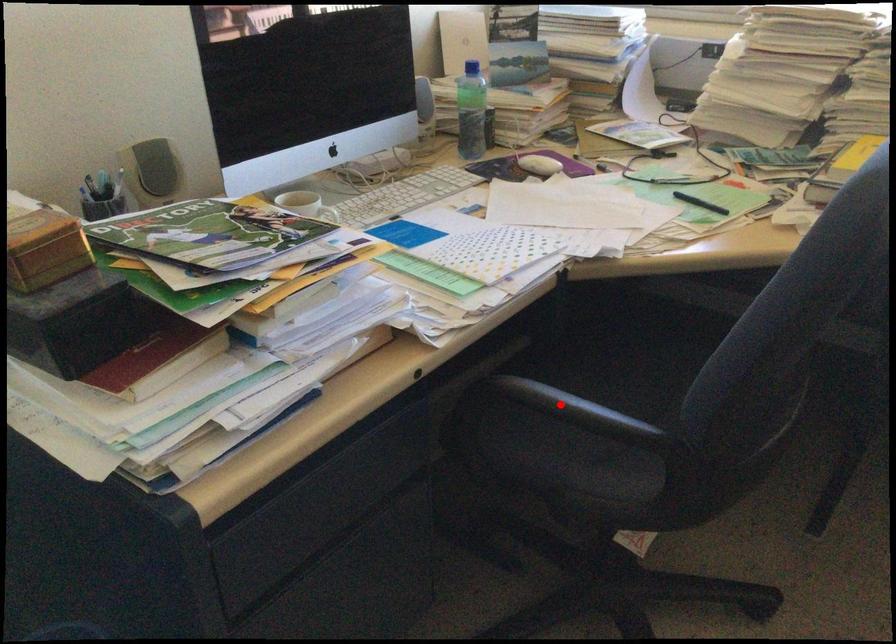
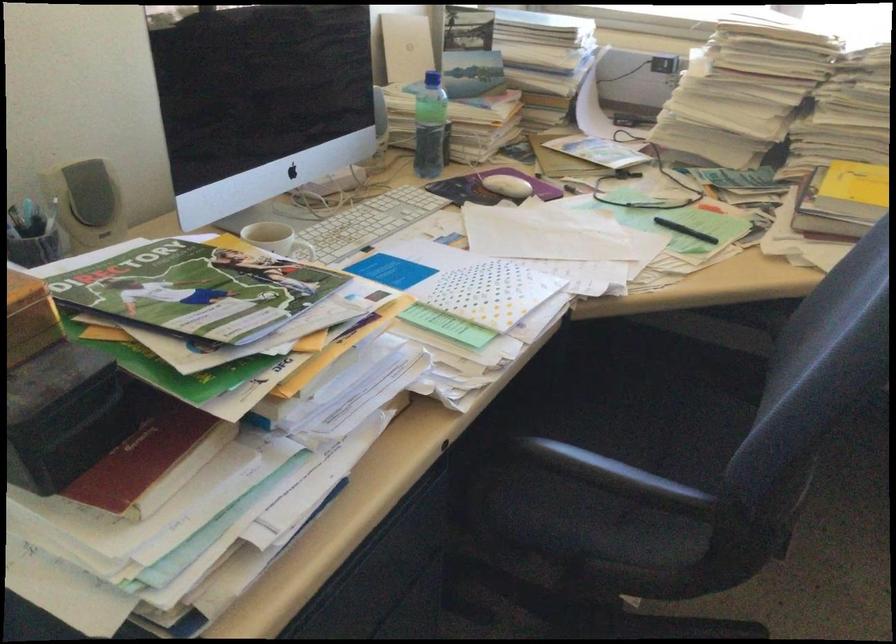
Find the pixel in the second image that matches the highlighted location in the first image.

(614, 474)